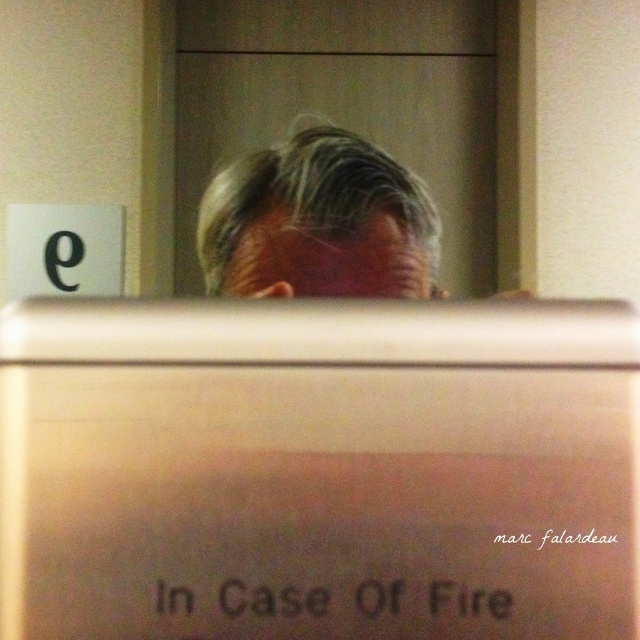
You are a delivery robot with a package that is 12 inches wide. You need to navigate through the space between the metallic silver computer screen at center and the gray matte hair at center. Can you fit through this space without tilting the package?

The distance between the metallic silver computer screen at center and the gray matte hair at center is 11.10 inches. Since your package is 12 inches wide, it is wider than the available space. Therefore, you cannot fit through without tilting or repositioning the package.

You are a maintenance worker checking the equipment in the room. You see the metallic silver computer screen at center and the gray matte hair at center. Which object is smaller in size?

The metallic silver computer screen at center is smaller in size compared to the gray matte hair at center.

You are standing in a room and see the metallic silver computer screen at center and the gray matte hair at center. Which object is nearer to you?

The metallic silver computer screen at center is closer to the viewer than the gray matte hair at center.